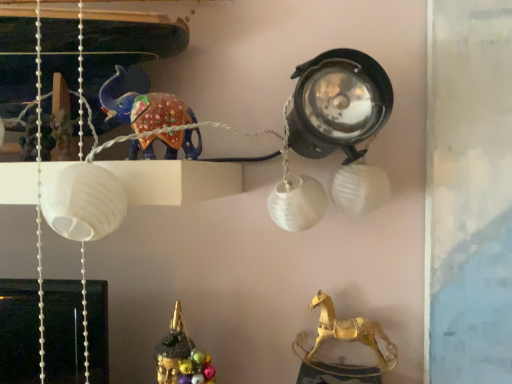
The width and height of the screenshot is (512, 384). Identify the location of shiny blue elephant at upper left, the first animal from the left. (142, 106).

Describe the element at coordinates (142, 106) in the screenshot. I see `shiny blue elephant at upper left, marked as the 1th animal in a top-to-bottom arrangement` at that location.

Measure the distance between point (x=367, y=330) and camera.

A distance of 64.50 centimeters exists between point (x=367, y=330) and camera.

This screenshot has height=384, width=512. Describe the element at coordinates (350, 332) in the screenshot. I see `gold metallic horse at lower right, the 1th animal when ordered from right to left` at that location.

At what (x,y) coordinates should I click in order to perform the action: click on gold metallic horse at lower right, the first animal in the bottom-to-top sequence. Please return your answer as a coordinate pair (x, y). This screenshot has width=512, height=384. Looking at the image, I should click on (350, 332).

This screenshot has height=384, width=512. In order to click on shiny blue elephant at upper left, which appears as the 1th animal when viewed from the front in this screenshot , I will do `click(142, 106)`.

Considering the positions of objects gold metallic horse at lower right, the first animal positioned from the back, and shiny blue elephant at upper left, the 2th animal ordered from the bottom, in the image provided, who is more to the right, gold metallic horse at lower right, the first animal positioned from the back, or shiny blue elephant at upper left, the 2th animal ordered from the bottom,?

Positioned to the right is gold metallic horse at lower right, the first animal positioned from the back.

Between gold metallic horse at lower right, which is counted as the 2th animal, starting from the top, and shiny blue elephant at upper left, arranged as the 2th animal when viewed from the right, which one is positioned in front?

Positioned in front is shiny blue elephant at upper left, arranged as the 2th animal when viewed from the right.

Which is less distant, (328, 319) or (170, 141)?

The point (170, 141) is in front.

From the image's perspective, is gold metallic horse at lower right, the first animal positioned from the back, located above or below shiny blue elephant at upper left, marked as the 1th animal in a top-to-bottom arrangement?

Clearly, from the image's perspective, gold metallic horse at lower right, the first animal positioned from the back, is below shiny blue elephant at upper left, marked as the 1th animal in a top-to-bottom arrangement.

From a real-world perspective, is gold metallic horse at lower right, placed as the second animal when sorted from front to back, positioned above or below shiny blue elephant at upper left, the first animal from the left?

gold metallic horse at lower right, placed as the second animal when sorted from front to back, is situated lower than shiny blue elephant at upper left, the first animal from the left, in the real world.

In the scene shown: Looking at their sizes, would you say gold metallic horse at lower right, the first animal positioned from the back, is wider or thinner than shiny blue elephant at upper left, which appears as the 1th animal when viewed from the front?

Clearly, gold metallic horse at lower right, the first animal positioned from the back, has less width compared to shiny blue elephant at upper left, which appears as the 1th animal when viewed from the front.

Who is shorter, gold metallic horse at lower right, placed as the second animal when sorted from front to back, or shiny blue elephant at upper left, which appears as the 1th animal when viewed from the front?

Standing shorter between the two is shiny blue elephant at upper left, which appears as the 1th animal when viewed from the front.

Considering the relative sizes of gold metallic horse at lower right, which is counted as the 2th animal, starting from the top, and shiny blue elephant at upper left, marked as the 1th animal in a top-to-bottom arrangement, in the image provided, is gold metallic horse at lower right, which is counted as the 2th animal, starting from the top, bigger than shiny blue elephant at upper left, marked as the 1th animal in a top-to-bottom arrangement,?

Actually, gold metallic horse at lower right, which is counted as the 2th animal, starting from the top, might be smaller than shiny blue elephant at upper left, marked as the 1th animal in a top-to-bottom arrangement.

Is shiny blue elephant at upper left, which is the 2th animal from back to front, surrounded by gold metallic horse at lower right, the 1th animal when ordered from right to left?

No.

Is gold metallic horse at lower right, placed as the second animal when sorted from front to back, beside shiny blue elephant at upper left, which appears as the 1th animal when viewed from the front?

No, gold metallic horse at lower right, placed as the second animal when sorted from front to back, is not with shiny blue elephant at upper left, which appears as the 1th animal when viewed from the front.

Is gold metallic horse at lower right, the first animal positioned from the back, turned away from shiny blue elephant at upper left, the first animal from the left?

No, gold metallic horse at lower right, the first animal positioned from the back, is not facing away from shiny blue elephant at upper left, the first animal from the left.

What's the angular difference between gold metallic horse at lower right, which is counted as the 2th animal, starting from the top, and shiny blue elephant at upper left, the 2th animal ordered from the bottom,'s facing directions?

They differ by 3.94 degrees in their facing directions.

This screenshot has height=384, width=512. In order to click on animal above the gold metallic horse at lower right, the 1th animal when ordered from right to left (from a real-world perspective) in this screenshot , I will do `click(142, 106)`.

Considering the relative positions of shiny blue elephant at upper left, the 2th animal ordered from the bottom, and gold metallic horse at lower right, which appears as the 2th animal when viewed from the left, in the image provided, is shiny blue elephant at upper left, the 2th animal ordered from the bottom, to the left of gold metallic horse at lower right, which appears as the 2th animal when viewed from the left, from the viewer's perspective?

Indeed, shiny blue elephant at upper left, the 2th animal ordered from the bottom, is positioned on the left side of gold metallic horse at lower right, which appears as the 2th animal when viewed from the left.

Which is behind, shiny blue elephant at upper left, which appears as the 1th animal when viewed from the front, or gold metallic horse at lower right, placed as the second animal when sorted from front to back?

gold metallic horse at lower right, placed as the second animal when sorted from front to back, is behind.

Is point (139, 148) less distant than point (387, 341)?

That is True.

From the image's perspective, which one is positioned higher, shiny blue elephant at upper left, the 2th animal ordered from the bottom, or gold metallic horse at lower right, placed as the second animal when sorted from front to back?

shiny blue elephant at upper left, the 2th animal ordered from the bottom, is shown above in the image.

From a real-world perspective, which object rests below the other?

gold metallic horse at lower right, placed as the second animal when sorted from front to back.

From the picture: Between shiny blue elephant at upper left, the 2th animal ordered from the bottom, and gold metallic horse at lower right, which appears as the 2th animal when viewed from the left, which one has larger width?

shiny blue elephant at upper left, the 2th animal ordered from the bottom.

Based on the photo, between shiny blue elephant at upper left, the first animal from the left, and gold metallic horse at lower right, placed as the second animal when sorted from front to back, which one has more height?

With more height is gold metallic horse at lower right, placed as the second animal when sorted from front to back.

Considering the sizes of shiny blue elephant at upper left, marked as the 1th animal in a top-to-bottom arrangement, and gold metallic horse at lower right, the first animal positioned from the back, in the image, is shiny blue elephant at upper left, marked as the 1th animal in a top-to-bottom arrangement, bigger or smaller than gold metallic horse at lower right, the first animal positioned from the back,?

shiny blue elephant at upper left, marked as the 1th animal in a top-to-bottom arrangement, is bigger than gold metallic horse at lower right, the first animal positioned from the back.

Is shiny blue elephant at upper left, arranged as the 2th animal when viewed from the right, outside of gold metallic horse at lower right, the first animal positioned from the back?

Yes, shiny blue elephant at upper left, arranged as the 2th animal when viewed from the right, is located beyond the bounds of gold metallic horse at lower right, the first animal positioned from the back.

Is shiny blue elephant at upper left, which appears as the 1th animal when viewed from the front, in contact with gold metallic horse at lower right, placed as the second animal when sorted from front to back?

shiny blue elephant at upper left, which appears as the 1th animal when viewed from the front, and gold metallic horse at lower right, placed as the second animal when sorted from front to back, are clearly separated.

Is shiny blue elephant at upper left, the 2th animal ordered from the bottom, oriented towards gold metallic horse at lower right, the first animal positioned from the back?

No, shiny blue elephant at upper left, the 2th animal ordered from the bottom, is not oriented towards gold metallic horse at lower right, the first animal positioned from the back.

Find the location of a particular element. Image resolution: width=512 pixels, height=384 pixels. animal above the gold metallic horse at lower right, which appears as the 2th animal when viewed from the left (from the image's perspective) is located at coordinates (142, 106).

This screenshot has height=384, width=512. Find the location of `animal that appears below the shiny blue elephant at upper left, which appears as the 1th animal when viewed from the front (from the image's perspective)`. animal that appears below the shiny blue elephant at upper left, which appears as the 1th animal when viewed from the front (from the image's perspective) is located at coordinates pos(350,332).

Find the location of `animal above the gold metallic horse at lower right, placed as the second animal when sorted from front to back (from the image's perspective)`. animal above the gold metallic horse at lower right, placed as the second animal when sorted from front to back (from the image's perspective) is located at coordinates [142, 106].